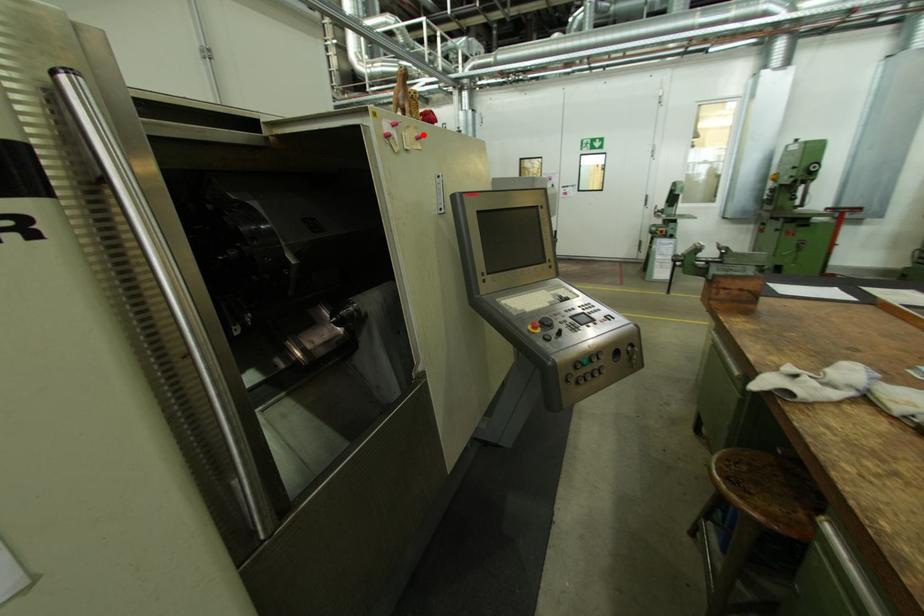
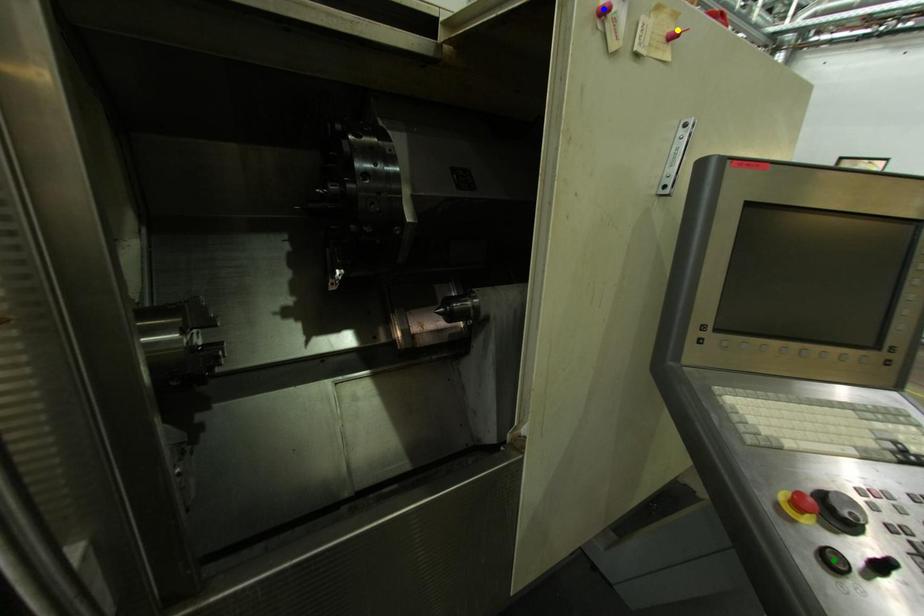
Question: I am providing you with two images of the same scene from different viewpoints. A red point is marked on the first image. You are given multiple points on the second image. Which point in image 2 is actually the same real-world point as the red point in image 1?

Choices:
 (A) yellow point
 (B) blue point
 (C) green point

Answer: (A)